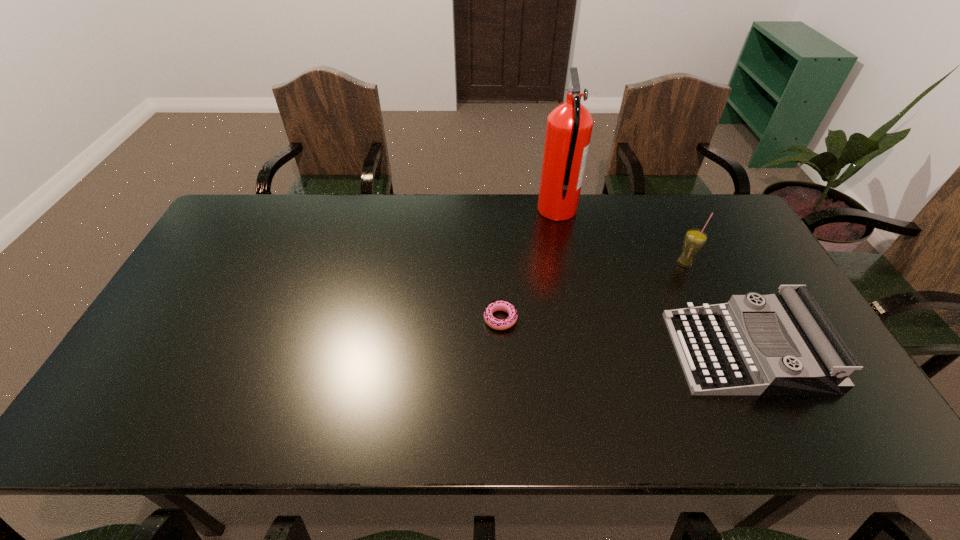
Find the location of `free region located on the back of the second tallest object`. free region located on the back of the second tallest object is located at coordinates (665, 221).

What are the coordinates of `vacant region located on the typing side of the third tallest object` in the screenshot? It's located at (549, 352).

Find the location of a particular element. This screenshot has height=540, width=960. free space located on the typing side of the third tallest object is located at coordinates (616, 352).

The height and width of the screenshot is (540, 960). Find the location of `free space located on the typing side of the third tallest object`. free space located on the typing side of the third tallest object is located at coordinates coord(585,352).

Where is `free space located on the front of the leftmost object`? free space located on the front of the leftmost object is located at coordinates (502, 358).

Identify the location of object present at the far edge. (569, 127).

Image resolution: width=960 pixels, height=540 pixels. Identify the location of object present at the right edge. tap(779, 344).

Where is `free space at the far edge of the desktop`? free space at the far edge of the desktop is located at coordinates (438, 219).

Locate an element on the screen. The height and width of the screenshot is (540, 960). free point at the near edge is located at coordinates (660, 426).

Find the location of a particular element. free spot at the far left corner of the desktop is located at coordinates (235, 212).